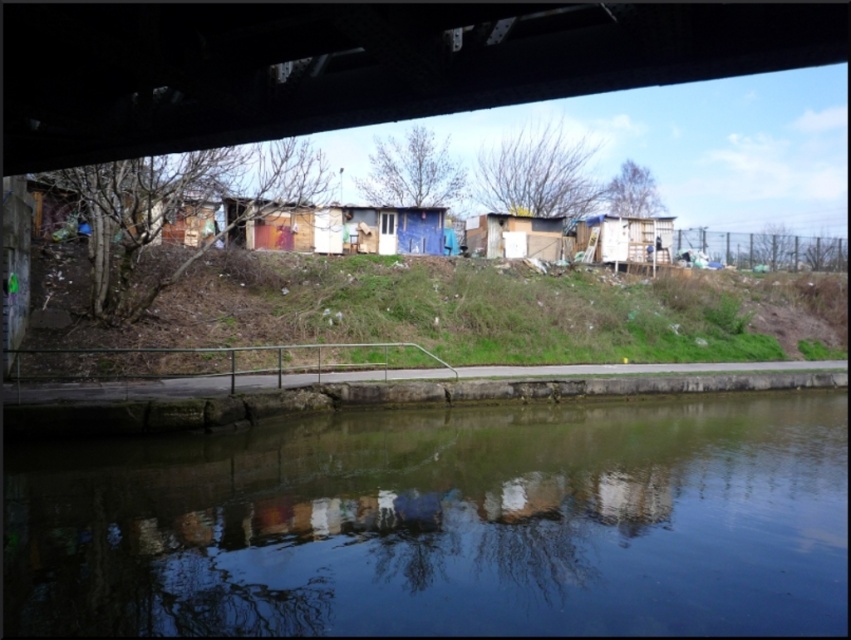
Question: Is smooth concrete river at lower center to the right of blue painted wood hut at center from the viewer's perspective?

Choices:
 (A) no
 (B) yes

Answer: (B)

Question: Which object appears farthest from the camera in this image?

Choices:
 (A) rustic wooden hut at center
 (B) white cardboard hut at center
 (C) smooth concrete river at lower center

Answer: (B)

Question: Among these objects, which one is nearest to the camera?

Choices:
 (A) white cardboard hut at center
 (B) green grassy hillside at lower center
 (C) blue painted wood hut at center
 (D) wooden shack at center

Answer: (B)

Question: Among these objects, which one is farthest from the camera?

Choices:
 (A) white cardboard hut at center
 (B) smooth concrete river at lower center

Answer: (A)

Question: Is green grassy hillside at lower center to the left of wooden shack at center from the viewer's perspective?

Choices:
 (A) yes
 (B) no

Answer: (A)

Question: Is green grassy hillside at lower center thinner than rustic wooden hut at center?

Choices:
 (A) no
 (B) yes

Answer: (A)